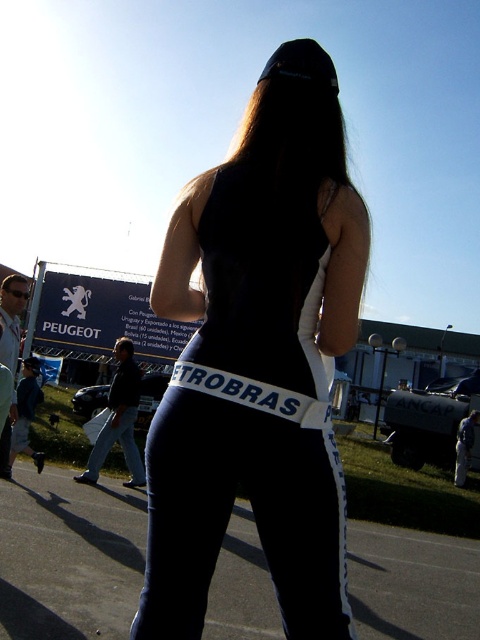
Does black matte tank top at center appear under navy blue leggings at center?

No, black matte tank top at center is not below navy blue leggings at center.

Who is positioned more to the left, black matte tank top at center or navy blue leggings at center?

black matte tank top at center is more to the left.

Is point (232, 467) positioned after point (295, 456)?

Yes, it is behind point (295, 456).

The width and height of the screenshot is (480, 640). What are the coordinates of `black matte tank top at center` in the screenshot? It's located at (259, 358).